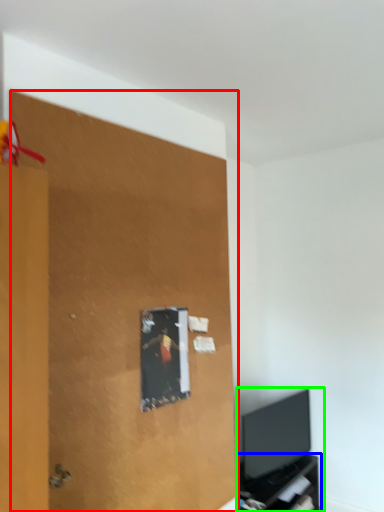
Question: Which object is positioned farthest from plywood (highlighted by a red box)? Select from tv cabinet (highlighted by a blue box) and entertainment center (highlighted by a green box).

Choices:
 (A) tv cabinet
 (B) entertainment center

Answer: (A)